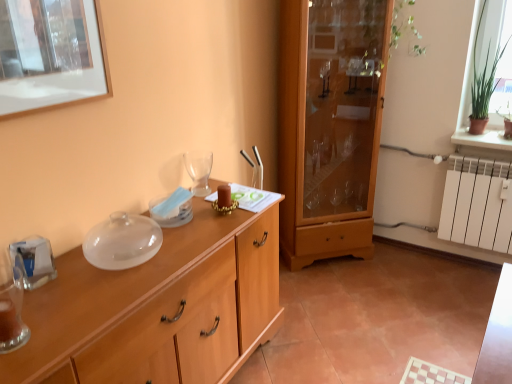
Image resolution: width=512 pixels, height=384 pixels. I want to click on spots to the right of translucent glass vase at left, so click(x=67, y=326).